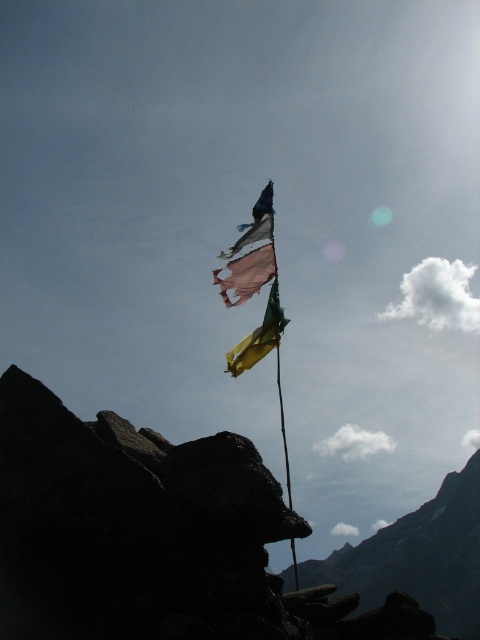
Question: Estimate the real-world distances between objects in this image. Which object is farther from the yellow-green silk flag at center?

Choices:
 (A) ripped fabric flag at upper center
 (B) rugged stone mountain at lower right

Answer: (B)

Question: Is ripped fabric flag at upper center thinner than yellow-green silk flag at center?

Choices:
 (A) no
 (B) yes

Answer: (A)

Question: Among these points, which one is farthest from the camera?

Choices:
 (A) (251, 285)
 (B) (266, 328)

Answer: (A)

Question: Among these points, which one is farthest from the camera?

Choices:
 (A) (384, 536)
 (B) (233, 280)
 (C) (274, 330)

Answer: (A)

Question: Does ripped fabric flag at upper center have a smaller size compared to yellow-green silk flag at center?

Choices:
 (A) yes
 (B) no

Answer: (A)

Question: From the image, what is the correct spatial relationship of ripped fabric flag at upper center in relation to yellow-green silk flag at center?

Choices:
 (A) above
 (B) below

Answer: (A)